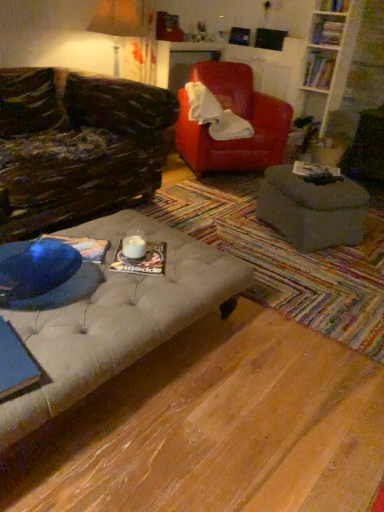
Where is `free space to the left of matte gray ottoman at center`? This screenshot has width=384, height=512. free space to the left of matte gray ottoman at center is located at coordinates (240, 220).